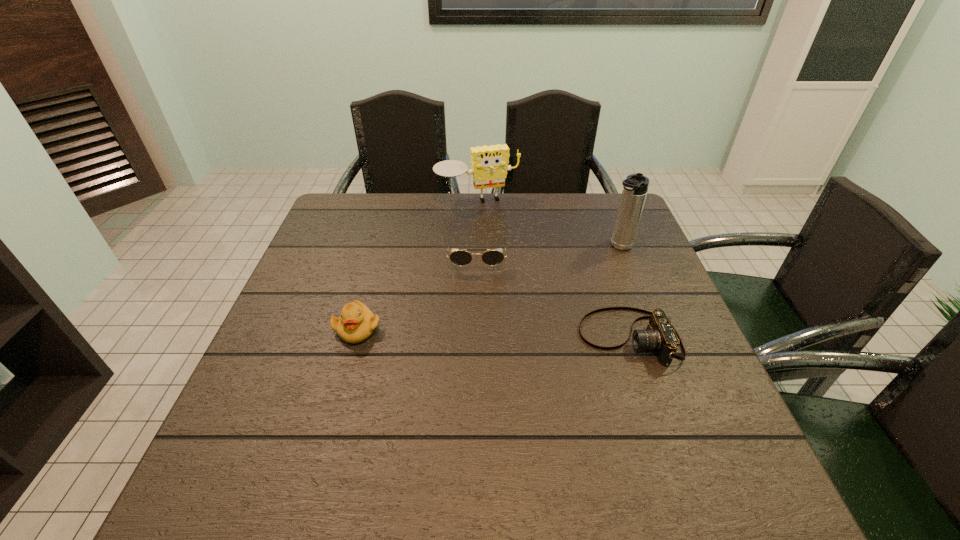
Identify the location of vacant space located on the handle side of the thermos bottle. This screenshot has width=960, height=540. (563, 303).

Locate an element on the screen. The height and width of the screenshot is (540, 960). free region located 0.240m on the handle side of the thermos bottle is located at coordinates click(x=566, y=299).

Locate an element on the screen. free space located on the handle side of the thermos bottle is located at coordinates (553, 312).

Where is `free space located 0.180m on the front-facing side of the farthest object`? This screenshot has width=960, height=540. free space located 0.180m on the front-facing side of the farthest object is located at coordinates 500,244.

At what (x,y) coordinates should I click in order to perform the action: click on blank space located 0.220m on the front-facing side of the farthest object. Please return your answer as a coordinate pair (x, y). This screenshot has height=540, width=960. Looking at the image, I should click on (504, 253).

You are a GUI agent. You are given a task and a screenshot of the screen. Output one action in this format:
    pyautogui.click(x=<x>, y=<y>)
    Task: Click on the vacant space located on the front-facing side of the farthest object
    Image resolution: width=960 pixels, height=540 pixels.
    Given the screenshot: What is the action you would take?
    491,221

Find the location of `free spot located on the front lenses of the sunglasses`. free spot located on the front lenses of the sunglasses is located at coordinates (477, 313).

The height and width of the screenshot is (540, 960). Find the location of `free location located 0.060m on the front lenses of the sunglasses`. free location located 0.060m on the front lenses of the sunglasses is located at coordinates (477, 288).

Identify the location of blank space located 0.090m on the front lenses of the sunglasses. (477, 295).

Find the location of a particular element. object at the far edge is located at coordinates (489, 166).